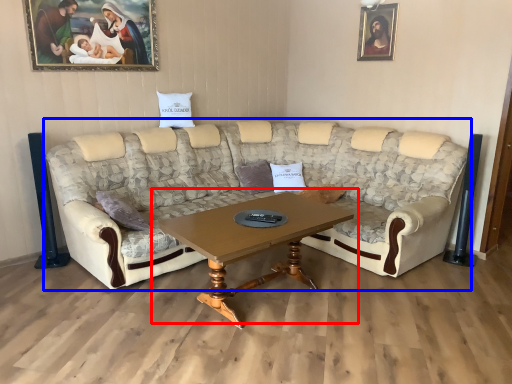
Question: Which point is closer to the camera, coffee table (highlighted by a red box) or studio couch (highlighted by a blue box)?

Choices:
 (A) coffee table
 (B) studio couch

Answer: (B)